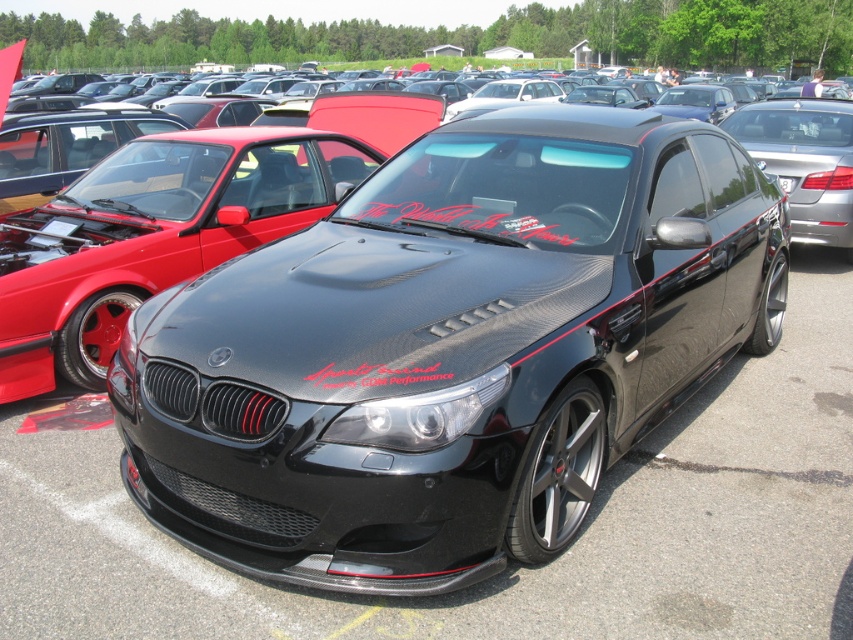
You are a photographer trying to capture the black carbon fiber sedan at center and the black carbon fiber license plate at center in a single frame. Can you fit both objects in your camera viewfinder without moving the camera?

The black carbon fiber sedan at center might be wider than black carbon fiber license plate at center, so it depends on the sedan and license plate width. If the sedan is wider, both can be captured together as the license plate is smaller and likely positioned on the sedan.